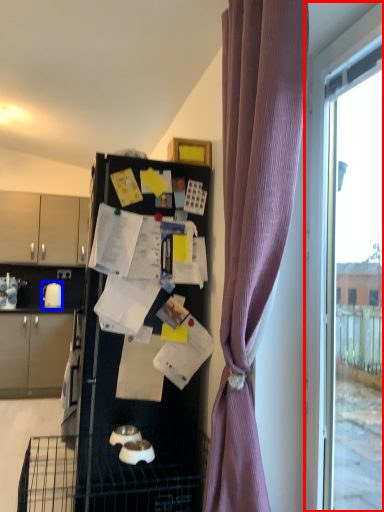
Question: Which object appears closest to the camera in this image, window (highlighted by a red box) or appliance (highlighted by a blue box)?

Choices:
 (A) window
 (B) appliance

Answer: (A)